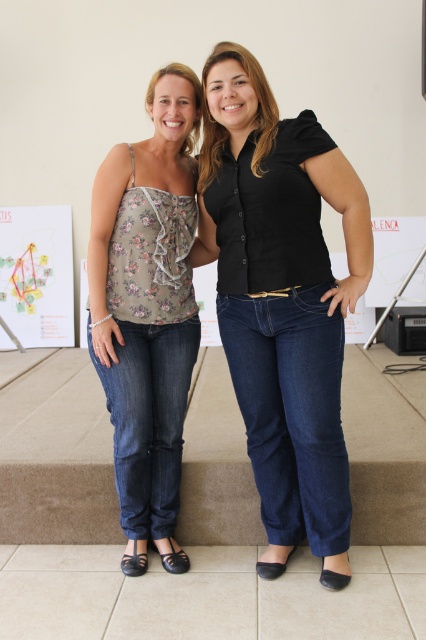
You are a photographer adjusting the camera settings to capture a clear photo of both the black matte shirt at center and the floral print fabric top at center. Given that the camera has a depth of field that can focus on objects within a 10 inch range, will both items remain in focus?

The black matte shirt at center is 11.16 inches away from the floral print fabric top at center. Since the distance between them exceeds the camera sensor depth of field range of 10 inches, the two items cannot be in focus simultaneously.

You are a fashion designer observing two women in the image. The first woman wears a black matte shirt at center and the second wears a floral print fabric top at center. Which clothing item has a bigger size?

The black matte shirt at center has a larger size compared to the floral print fabric top at center.

Please describe the position of the black matte shirt at center in terms of coordinates in the image. The image coordinate system has its origin at the bottom left corner, with the x and y axes increasing to the right and up respectively. The coordinates are normalized between 0 and 1. Please provide the coordinates as a tuple of two decimal numbers rounded to three decimal places.

The black matte shirt at center is located at coordinates approximately equal to the given point, so the coordinates are approximately 0.469 in the x direction and 0.662 in the y direction.